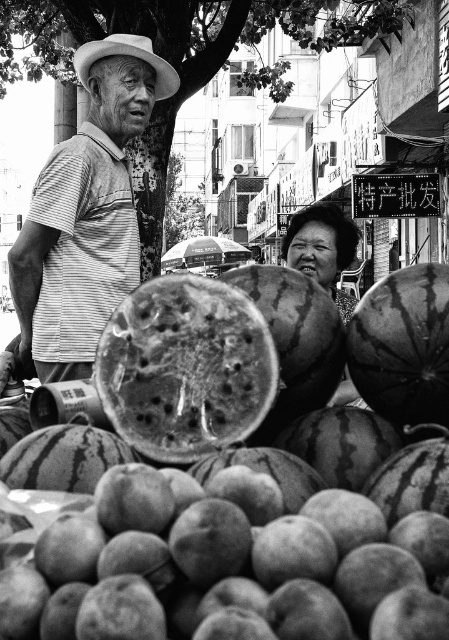
Question: Is striped cotton shirt at left wider than white felt cowboy hat at upper left?

Choices:
 (A) yes
 (B) no

Answer: (A)

Question: Among these objects, which one is farthest from the camera?

Choices:
 (A) smooth brown peaches at lower center
 (B) striped cotton shirt at left
 (C) spongy green watermelon at center
 (D) white felt cowboy hat at upper left

Answer: (D)

Question: Is spongy green watermelon at center closer to the viewer compared to ripe green watermelon at center?

Choices:
 (A) no
 (B) yes

Answer: (B)

Question: Which of the following is the closest to the observer?

Choices:
 (A) white felt cowboy hat at upper left
 (B) smooth dark green watermelon at center
 (C) spongy green watermelon at center
 (D) smooth brown peaches at lower center

Answer: (D)

Question: Does striped cotton shirt at left appear under white felt cowboy hat at upper left?

Choices:
 (A) no
 (B) yes

Answer: (B)

Question: Which object is positioned closest to the smooth brown peaches at lower center?

Choices:
 (A) white felt cowboy hat at upper left
 (B) striped cotton shirt at left

Answer: (B)